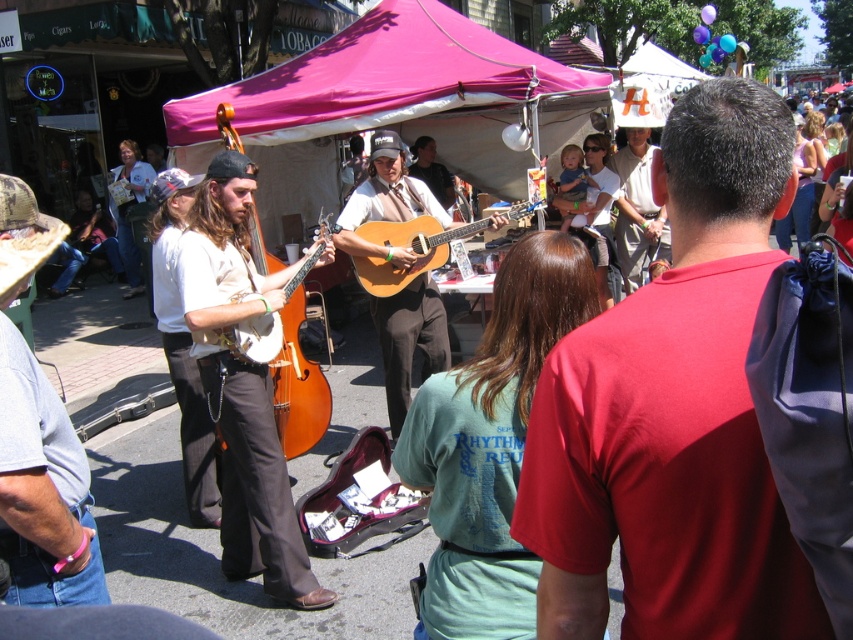
Is light gray cotton shirt at left below matte brown guitar at center?

Correct, light gray cotton shirt at left is located below matte brown guitar at center.

Measure the distance between light gray cotton shirt at left and matte brown guitar at center.

A distance of 25.49 feet exists between light gray cotton shirt at left and matte brown guitar at center.

Is point (4, 323) farther from camera compared to point (436, 195)?

No, (4, 323) is closer to viewer.

I want to click on light gray cotton shirt at left, so point(41,484).

Does wooden acoustic guitar at center have a lesser height compared to matte brown guitar at center?

Incorrect, wooden acoustic guitar at center's height does not fall short of matte brown guitar at center's.

Is wooden acoustic guitar at center wider than matte brown guitar at center?

Yes.

Which is in front, point (431, 214) or point (418, 173)?

Point (431, 214)

Find the location of a particular element. The height and width of the screenshot is (640, 853). wooden acoustic guitar at center is located at coordinates 409,340.

Between point (297, 324) and point (386, 221), which one is positioned in front?

Point (297, 324)

Image resolution: width=853 pixels, height=640 pixels. I want to click on matte white banjo at center, so click(x=299, y=387).